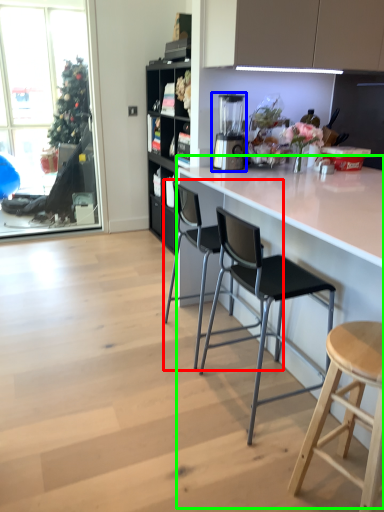
Question: Estimate the real-world distances between objects in this image. Which object is closer to chair (highlighted by a red box), appliance (highlighted by a blue box) or counter (highlighted by a green box)?

Choices:
 (A) appliance
 (B) counter

Answer: (B)